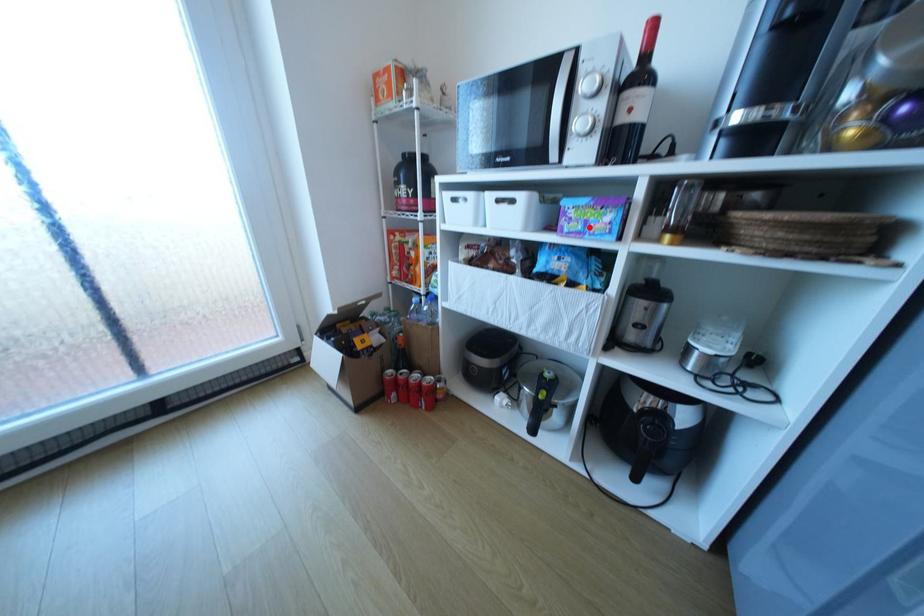
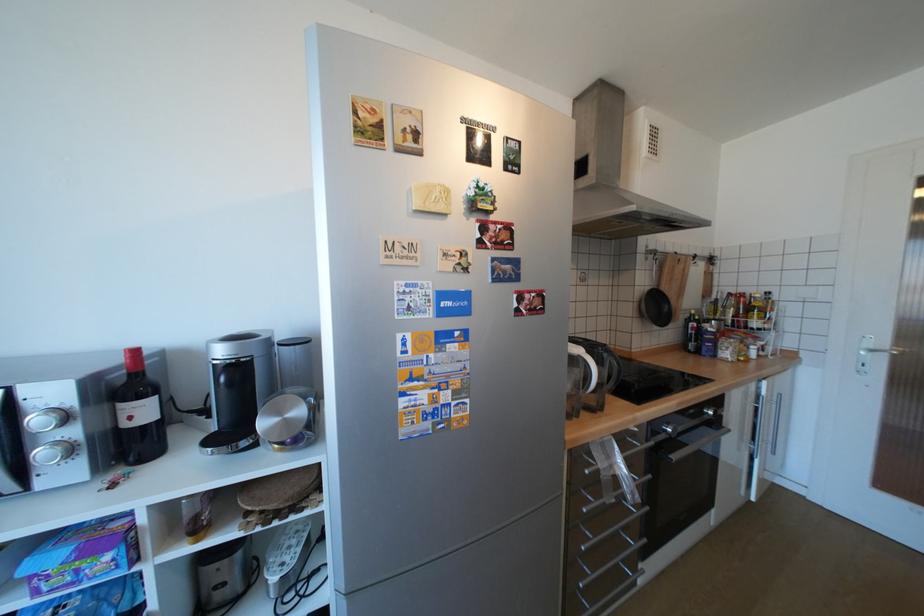
Question: A red point is marked in image1. In image2, is the corresponding 3D point closer to the camera or farther? Reply with the corresponding letter.

Choices:
 (A) The corresponding 3D point is closer.
 (B) The corresponding 3D point is farther.

Answer: (A)